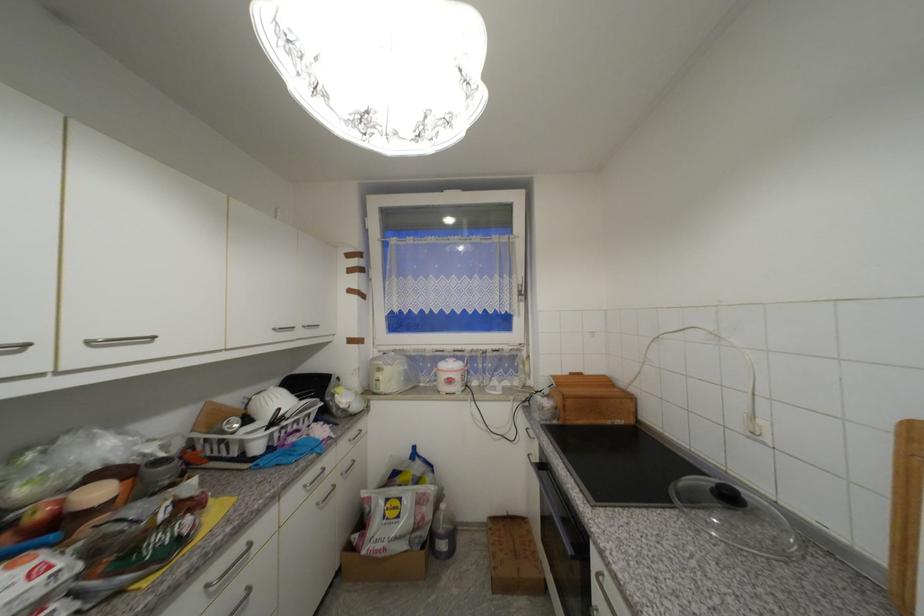
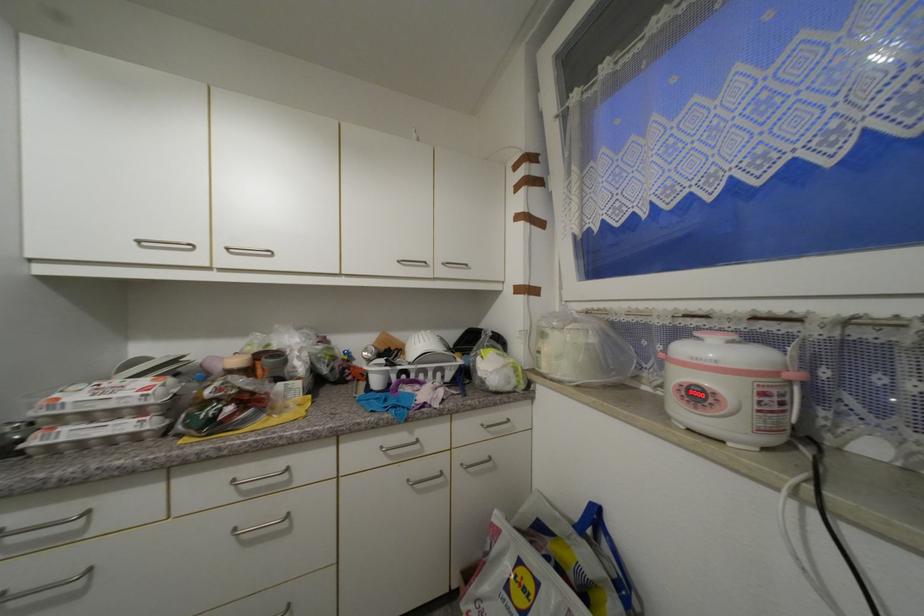
The point at [281,331] is marked in the first image. Where is the corresponding point in the second image?

(405, 262)